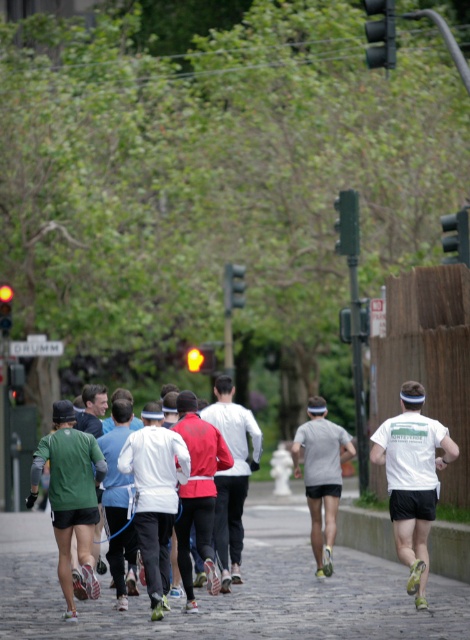
Question: Considering the real-world distances, which object is closest to the yellow glass traffic light at upper center?

Choices:
 (A) matte white jacket at center
 (B) green matte running shirt at left
 (C) green matte traffic light at upper right
 (D) black plastic traffic light at upper right

Answer: (A)

Question: Which point is closer to the camera taking this photo?

Choices:
 (A) (240, 282)
 (B) (1, 332)
 (C) (94, 476)

Answer: (C)

Question: Which point is farther from the camera taking this photo?

Choices:
 (A) (208, 356)
 (B) (383, 52)
 (C) (5, 291)
 (D) (396, 422)

Answer: (A)

Question: Does green matte running shirt at left appear under black plastic traffic light at center?

Choices:
 (A) yes
 (B) no

Answer: (A)

Question: Can you confirm if red matte jacket at center is thinner than yellow glass traffic light at upper left?

Choices:
 (A) yes
 (B) no

Answer: (B)

Question: Does yellow glass traffic light at upper left have a larger size compared to white matte jacket at center?

Choices:
 (A) no
 (B) yes

Answer: (A)